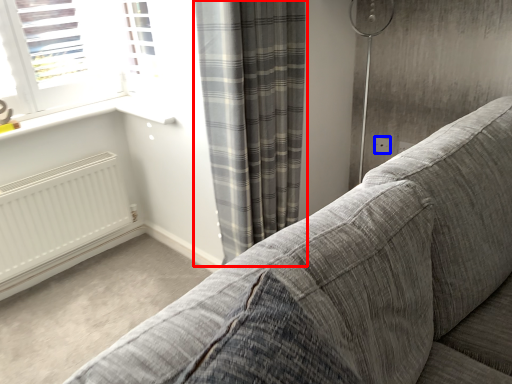
Question: Which of the following is the farthest to the observer, curtain (highlighted by a red box) or electric outlet (highlighted by a blue box)?

Choices:
 (A) curtain
 (B) electric outlet

Answer: (B)